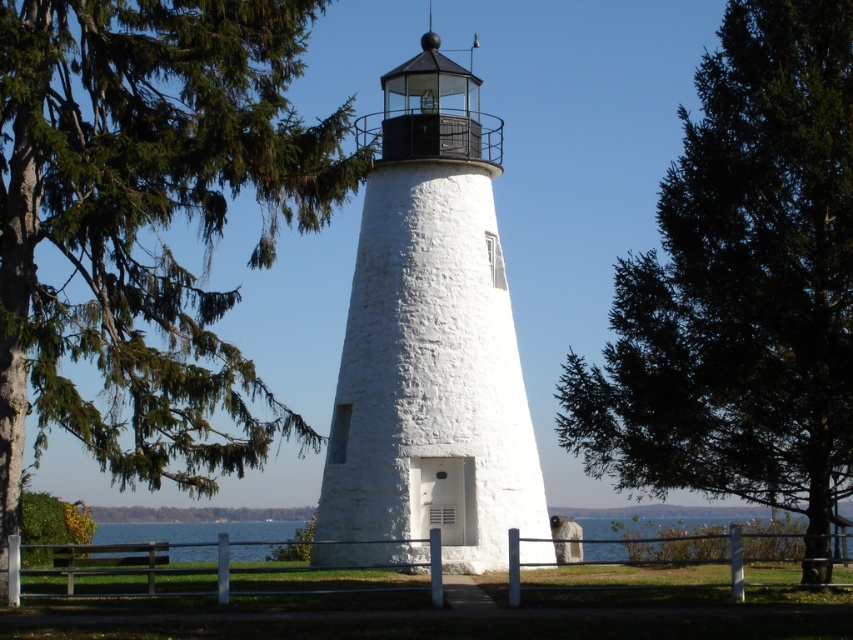
This screenshot has width=853, height=640. Describe the element at coordinates (740, 285) in the screenshot. I see `green leafy tree at center` at that location.

Who is positioned more to the left, green leafy tree at center or blue water at lower center?

Positioned to the left is blue water at lower center.

At what (x,y) coordinates should I click in order to perform the action: click on green leafy tree at center. Please return your answer as a coordinate pair (x, y). Looking at the image, I should click on click(x=740, y=285).

You are a GUI agent. You are given a task and a screenshot of the screen. Output one action in this format:
    pyautogui.click(x=<x>, y=<y>)
    Task: Click on the green leafy tree at center
    The height and width of the screenshot is (640, 853).
    Given the screenshot: What is the action you would take?
    pyautogui.click(x=740, y=285)

Which of these two, white stucco lighthouse at center or blue water at lower center, stands taller?

white stucco lighthouse at center

Where is `white stucco lighthouse at center`? The width and height of the screenshot is (853, 640). white stucco lighthouse at center is located at coordinates (428, 342).

Who is more distant from viewer, (798, 296) or (410, 404)?

Point (410, 404)

You are a GUI agent. You are given a task and a screenshot of the screen. Output one action in this format:
    pyautogui.click(x=<x>, y=<y>)
    Task: Click on the green leafy tree at center
    
    Given the screenshot: What is the action you would take?
    pyautogui.click(x=740, y=285)